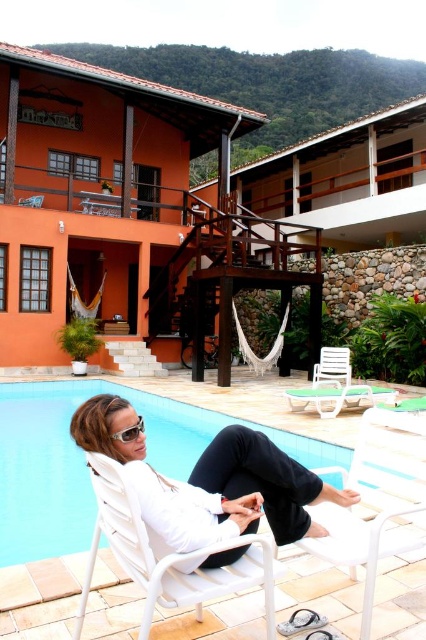
Consider the image. Does white plastic lounge chair at lower right have a larger size compared to matte white sunglasses at lower center?

Correct, white plastic lounge chair at lower right is larger in size than matte white sunglasses at lower center.

Where is `white plastic lounge chair at lower right`? white plastic lounge chair at lower right is located at coordinates click(x=336, y=387).

Does point (123, 113) come farther from viewer compared to point (310, 397)?

Yes, it is behind point (310, 397).

Find the location of `orange wood house at upper left`. orange wood house at upper left is located at coordinates (126, 212).

Who is more distant from viewer, [310,301] or [339,353]?

Point [310,301]

The height and width of the screenshot is (640, 426). I want to click on orange wood house at upper left, so click(x=126, y=212).

Is orange wood house at upper left bigger than white matte chair at lower center?

Indeed, orange wood house at upper left has a larger size compared to white matte chair at lower center.

Is orange wood house at upper left shorter than white matte chair at lower center?

Incorrect, orange wood house at upper left's height does not fall short of white matte chair at lower center's.

What do you see at coordinates (126, 212) in the screenshot?
I see `orange wood house at upper left` at bounding box center [126, 212].

Locate an element on the screen. This screenshot has width=426, height=640. orange wood house at upper left is located at coordinates (126, 212).